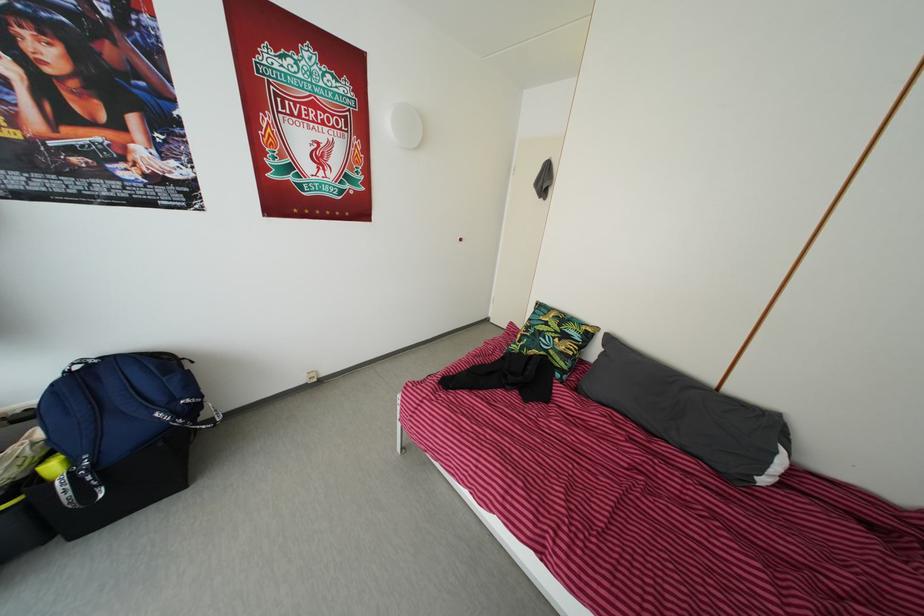
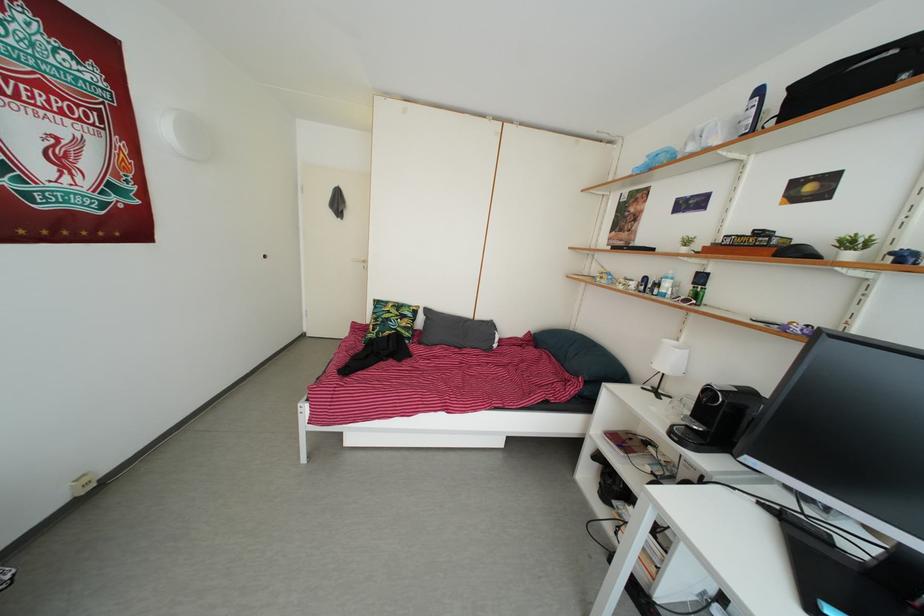
Locate, in the second image, the point that corresponds to pixel 540 342 in the first image.

(388, 330)